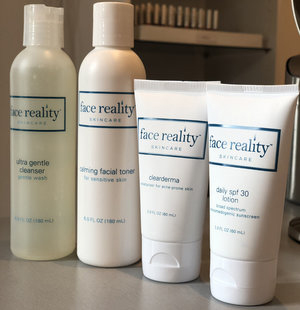
Locate an element on the screen. table is located at coordinates (79, 289).